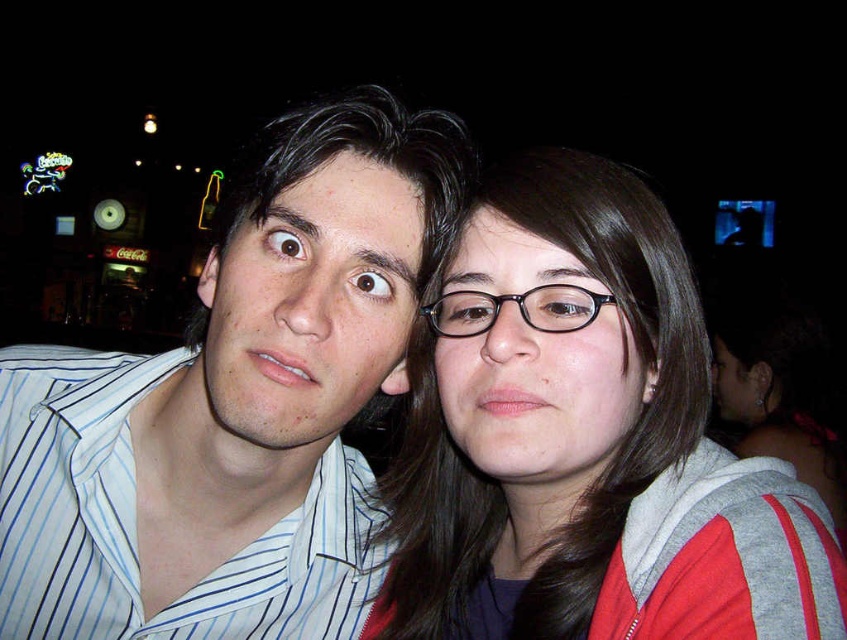
Question: Can you confirm if matte gray hoodie at center is positioned to the right of black plastic glasses at center?

Choices:
 (A) yes
 (B) no

Answer: (A)

Question: Which point is closer to the camera?

Choices:
 (A) black plastic glasses at center
 (B) white striped shirt at left

Answer: (B)

Question: Can you confirm if white striped shirt at left is thinner than black plastic glasses at center?

Choices:
 (A) yes
 (B) no

Answer: (B)

Question: Observing the image, what is the correct spatial positioning of white striped shirt at left in reference to black plastic glasses at center?

Choices:
 (A) left
 (B) right

Answer: (A)

Question: Which of the following is the closest to the observer?

Choices:
 (A) (186, 500)
 (B) (471, 467)

Answer: (A)

Question: Which of the following is the farthest from the observer?

Choices:
 (A) (242, 632)
 (B) (486, 188)

Answer: (B)